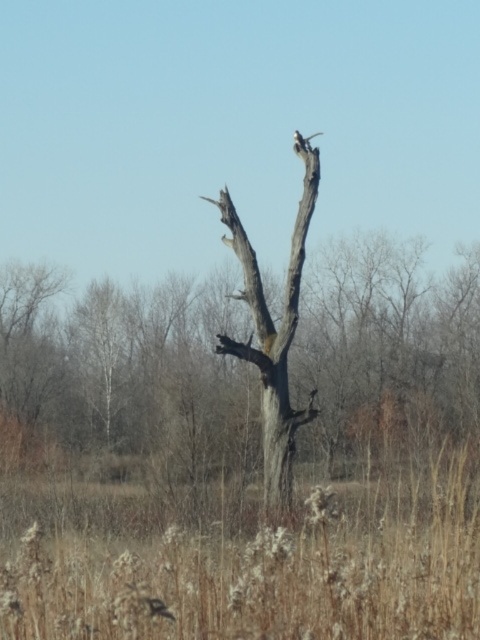
Between gray rough bark tree at center and white feathered bird at upper center, which one is positioned lower?

gray rough bark tree at center

Can you confirm if gray rough bark tree at center is positioned to the right of white feathered bird at upper center?

No, gray rough bark tree at center is not to the right of white feathered bird at upper center.

Is point (288, 317) positioned before point (299, 138)?

Yes, point (288, 317) is closer to viewer.

This screenshot has width=480, height=640. Find the location of `gray rough bark tree at center`. gray rough bark tree at center is located at coordinates pos(273,337).

Is the position of brown dry grass at center more distant than that of white feathered bird at upper center?

No, it is in front of white feathered bird at upper center.

Between brown dry grass at center and white feathered bird at upper center, which one is positioned higher?

white feathered bird at upper center

Between point (146, 621) and point (298, 145), which one is positioned behind?

The point (298, 145) is behind.

Where is `brown dry grass at center`? This screenshot has width=480, height=640. brown dry grass at center is located at coordinates (259, 577).

Is point (62, 561) farther from camera compared to point (248, 291)?

No, it is not.

Measure the distance between brown dry grass at center and camera.

The distance of brown dry grass at center from camera is 4.28 meters.

In order to click on brown dry grass at center in this screenshot , I will do `click(259, 577)`.